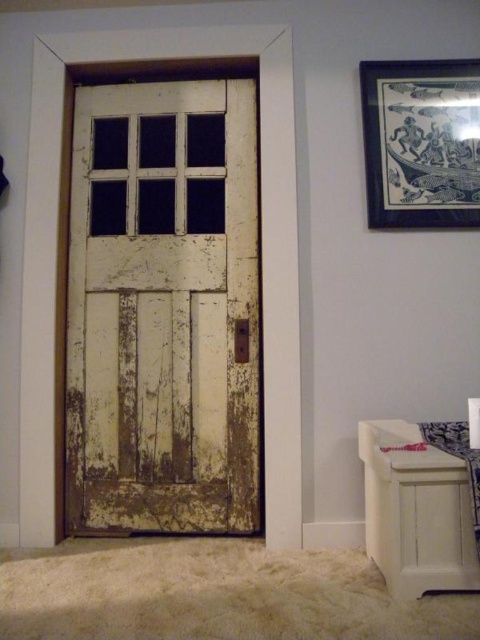
You are standing in front of the white weathered wood door at center and the black paper picture frame at upper right. Which object is bigger in size?

The white weathered wood door at center is larger in size than the black paper picture frame at upper right.

You are standing in front of the white weathered wood door at center and the black paper picture frame at upper right. Which object is located to the right of the other?

The black paper picture frame at upper right is located to the right of the white weathered wood door at center.